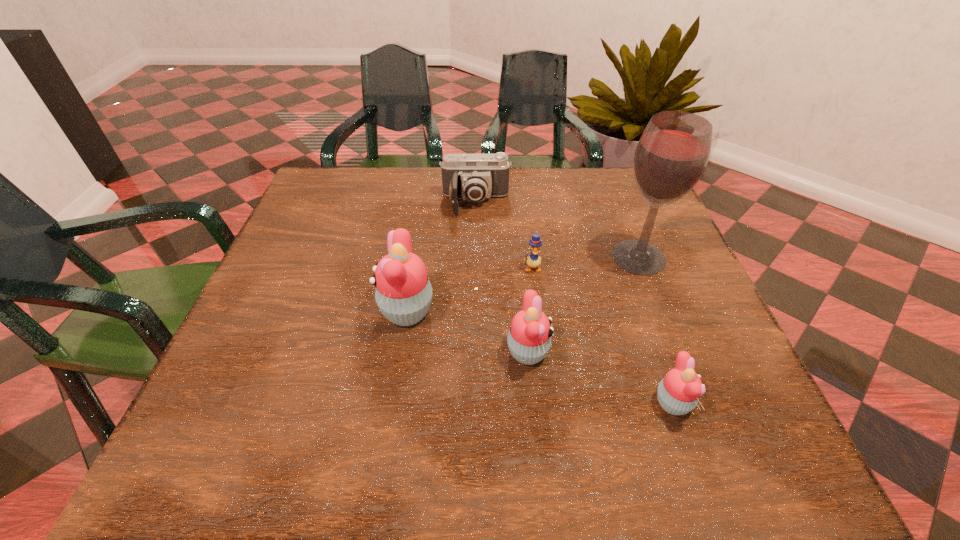
Find the location of a particular element. This screenshot has height=540, width=960. vacant space that satisfies the following two spatial constraints: 1. at the front of the camera with an open lens cover; 2. on the face of the tallest cupcake is located at coordinates (474, 310).

Image resolution: width=960 pixels, height=540 pixels. In order to click on free space that satisfies the following two spatial constraints: 1. on the face of the duckling, where the monocle is placed; 2. on the face of the second tallest cupcake in this screenshot , I will do `click(542, 353)`.

Find the location of `vacant space that satisfies the following two spatial constraints: 1. on the face of the duckling, where the monocle is placed; 2. on the face of the leftmost cupcake`. vacant space that satisfies the following two spatial constraints: 1. on the face of the duckling, where the monocle is placed; 2. on the face of the leftmost cupcake is located at coordinates (538, 310).

This screenshot has width=960, height=540. What are the coordinates of `free spot that satisfies the following two spatial constraints: 1. at the front of the camera with an open lens cover; 2. on the face of the second tallest object` in the screenshot? It's located at (474, 310).